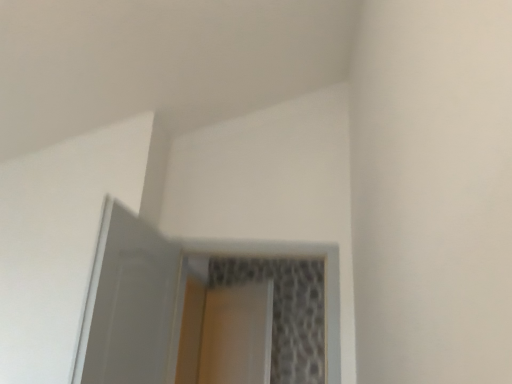
Image resolution: width=512 pixels, height=384 pixels. What do you see at coordinates (237, 334) in the screenshot?
I see `clear glass screen door at center, the 2th screen door viewed from the front` at bounding box center [237, 334].

I want to click on clear glass screen door at center, the 2th screen door viewed from the front, so click(237, 334).

The width and height of the screenshot is (512, 384). I want to click on white glossy door at upper left, acting as the second screen door starting from the back, so click(x=128, y=303).

The width and height of the screenshot is (512, 384). Describe the element at coordinates (128, 303) in the screenshot. I see `white glossy door at upper left, which is the first screen door in front-to-back order` at that location.

Identify the location of clear glass screen door at center, the 2th screen door viewed from the front. (237, 334).

Is white glossy door at upper left, which is the first screen door in front-to-back order, to the left of clear glass screen door at center, the 2th screen door viewed from the front, from the viewer's perspective?

Yes, white glossy door at upper left, which is the first screen door in front-to-back order, is to the left of clear glass screen door at center, the 2th screen door viewed from the front.

Considering the positions of objects white glossy door at upper left, acting as the second screen door starting from the back, and clear glass screen door at center, the 2th screen door viewed from the front, in the image provided, who is behind, white glossy door at upper left, acting as the second screen door starting from the back, or clear glass screen door at center, the 2th screen door viewed from the front,?

clear glass screen door at center, the 2th screen door viewed from the front, is behind.

Between point (119, 362) and point (228, 337), which one is positioned in front?

The point (119, 362) is in front.

From the image's perspective, who appears lower, white glossy door at upper left, acting as the second screen door starting from the back, or clear glass screen door at center, acting as the 1th screen door starting from the back?

clear glass screen door at center, acting as the 1th screen door starting from the back, appears lower in the image.

From a real-world perspective, between white glossy door at upper left, which is the first screen door in front-to-back order, and clear glass screen door at center, acting as the 1th screen door starting from the back, who is vertically higher?

white glossy door at upper left, which is the first screen door in front-to-back order, from a real-world perspective.

Can you confirm if white glossy door at upper left, acting as the second screen door starting from the back, is wider than clear glass screen door at center, acting as the 1th screen door starting from the back?

Yes.

Is white glossy door at upper left, acting as the second screen door starting from the back, taller than clear glass screen door at center, acting as the 1th screen door starting from the back?

No.

Who is bigger, white glossy door at upper left, which is the first screen door in front-to-back order, or clear glass screen door at center, the 2th screen door viewed from the front?

white glossy door at upper left, which is the first screen door in front-to-back order.

In the scene shown: Could clear glass screen door at center, the 2th screen door viewed from the front, be considered to be inside white glossy door at upper left, acting as the second screen door starting from the back?

Actually, clear glass screen door at center, the 2th screen door viewed from the front, is outside white glossy door at upper left, acting as the second screen door starting from the back.

Is white glossy door at upper left, which is the first screen door in front-to-back order, not near clear glass screen door at center, acting as the 1th screen door starting from the back?

Yes, white glossy door at upper left, which is the first screen door in front-to-back order, and clear glass screen door at center, acting as the 1th screen door starting from the back, are located far from each other.

Is white glossy door at upper left, acting as the second screen door starting from the back, oriented away from clear glass screen door at center, the 2th screen door viewed from the front?

white glossy door at upper left, acting as the second screen door starting from the back, does not have its back to clear glass screen door at center, the 2th screen door viewed from the front.

How different are the orientations of white glossy door at upper left, which is the first screen door in front-to-back order, and clear glass screen door at center, acting as the 1th screen door starting from the back, in degrees?

126 degrees separate the facing orientations of white glossy door at upper left, which is the first screen door in front-to-back order, and clear glass screen door at center, acting as the 1th screen door starting from the back.

Where is `screen door lying above the clear glass screen door at center, the 2th screen door viewed from the front (from the image's perspective)`? screen door lying above the clear glass screen door at center, the 2th screen door viewed from the front (from the image's perspective) is located at coordinates (128, 303).

Which is more to the right, clear glass screen door at center, acting as the 1th screen door starting from the back, or white glossy door at upper left, acting as the second screen door starting from the back?

clear glass screen door at center, acting as the 1th screen door starting from the back, is more to the right.

Considering the relative positions of clear glass screen door at center, acting as the 1th screen door starting from the back, and white glossy door at upper left, which is the first screen door in front-to-back order, in the image provided, is clear glass screen door at center, acting as the 1th screen door starting from the back, behind white glossy door at upper left, which is the first screen door in front-to-back order,?

Yes.

Which point is more distant from viewer, (247, 299) or (142, 242)?

The point (247, 299) is more distant.

From the image's perspective, is clear glass screen door at center, acting as the 1th screen door starting from the back, on white glossy door at upper left, acting as the second screen door starting from the back?

No, from the image's perspective, clear glass screen door at center, acting as the 1th screen door starting from the back, is not over white glossy door at upper left, acting as the second screen door starting from the back.

From a real-world perspective, is clear glass screen door at center, acting as the 1th screen door starting from the back, positioned over white glossy door at upper left, acting as the second screen door starting from the back, based on gravity?

No, from a real-world perspective, clear glass screen door at center, acting as the 1th screen door starting from the back, is not over white glossy door at upper left, acting as the second screen door starting from the back

Considering the relative sizes of clear glass screen door at center, acting as the 1th screen door starting from the back, and white glossy door at upper left, acting as the second screen door starting from the back, in the image provided, is clear glass screen door at center, acting as the 1th screen door starting from the back, thinner than white glossy door at upper left, acting as the second screen door starting from the back,?

Yes.

From their relative heights in the image, would you say clear glass screen door at center, the 2th screen door viewed from the front, is taller or shorter than white glossy door at upper left, which is the first screen door in front-to-back order?

clear glass screen door at center, the 2th screen door viewed from the front, is taller than white glossy door at upper left, which is the first screen door in front-to-back order.

Considering the relative sizes of clear glass screen door at center, the 2th screen door viewed from the front, and white glossy door at upper left, which is the first screen door in front-to-back order, in the image provided, is clear glass screen door at center, the 2th screen door viewed from the front, bigger than white glossy door at upper left, which is the first screen door in front-to-back order,?

Incorrect, clear glass screen door at center, the 2th screen door viewed from the front, is not larger than white glossy door at upper left, which is the first screen door in front-to-back order.

Choose the correct answer: Is clear glass screen door at center, the 2th screen door viewed from the front, inside white glossy door at upper left, acting as the second screen door starting from the back, or outside it?

clear glass screen door at center, the 2th screen door viewed from the front, exists outside the volume of white glossy door at upper left, acting as the second screen door starting from the back.

Are clear glass screen door at center, acting as the 1th screen door starting from the back, and white glossy door at upper left, which is the first screen door in front-to-back order, making contact?

clear glass screen door at center, acting as the 1th screen door starting from the back, and white glossy door at upper left, which is the first screen door in front-to-back order, are not in contact.

Is clear glass screen door at center, acting as the 1th screen door starting from the back, positioned with its back to white glossy door at upper left, acting as the second screen door starting from the back?

No, clear glass screen door at center, acting as the 1th screen door starting from the back, is not facing away from white glossy door at upper left, acting as the second screen door starting from the back.

You are a GUI agent. You are given a task and a screenshot of the screen. Output one action in this format:
    pyautogui.click(x=<x>, y=<y>)
    Task: Click on the screen door on the left of clear glass screen door at center, the 2th screen door viewed from the front
    This screenshot has height=384, width=512.
    Given the screenshot: What is the action you would take?
    pyautogui.click(x=128, y=303)

This screenshot has width=512, height=384. I want to click on screen door above the clear glass screen door at center, acting as the 1th screen door starting from the back (from the image's perspective), so point(128,303).

You are a GUI agent. You are given a task and a screenshot of the screen. Output one action in this format:
    pyautogui.click(x=<x>, y=<y>)
    Task: Click on the screen door located below the white glossy door at upper left, acting as the second screen door starting from the back (from the image's perspective)
    The image size is (512, 384).
    Given the screenshot: What is the action you would take?
    pyautogui.click(x=237, y=334)